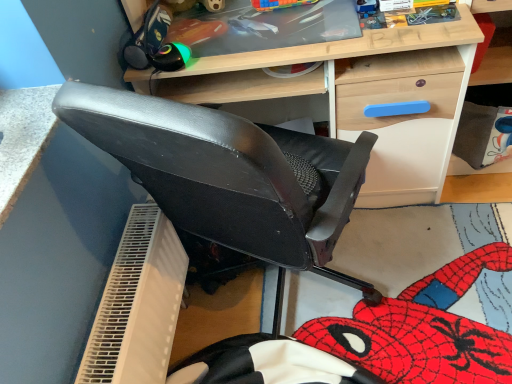
The image size is (512, 384). What are the coordinates of `white textured table at upper left` in the screenshot? It's located at (22, 138).

Image resolution: width=512 pixels, height=384 pixels. Describe the element at coordinates (22, 138) in the screenshot. I see `white textured table at upper left` at that location.

Describe the element at coordinates (362, 96) in the screenshot. I see `light wood desk at center` at that location.

What is the approximate width of light wood desk at center?

22.04 inches.

In order to face light wood desk at center, should I rotate leftwards or rightwards?

Turn right by 5.870 degrees to look at light wood desk at center.

Identify the location of light wood desk at center. This screenshot has width=512, height=384. coord(362,96).

I want to click on white textured table at upper left, so click(22, 138).

Considering the relative positions of white textured table at upper left and light wood desk at center in the image provided, is white textured table at upper left to the left of light wood desk at center from the viewer's perspective?

Correct, you'll find white textured table at upper left to the left of light wood desk at center.

Does white textured table at upper left lie in front of light wood desk at center?

Yes, white textured table at upper left is closer to the viewer.

Is point (24, 130) positioned in front of point (345, 133)?

Yes, it is in front of point (345, 133).

From the image's perspective, which is above, white textured table at upper left or light wood desk at center?

light wood desk at center appears higher in the image.

From a real-world perspective, is white textured table at upper left on light wood desk at center?

Indeed, from a real-world perspective, white textured table at upper left stands above light wood desk at center.

Considering the relative sizes of white textured table at upper left and light wood desk at center in the image provided, is white textured table at upper left wider than light wood desk at center?

No, white textured table at upper left is not wider than light wood desk at center.

Considering the sizes of objects white textured table at upper left and light wood desk at center in the image provided, who is shorter, white textured table at upper left or light wood desk at center?

Standing shorter between the two is white textured table at upper left.

Considering the sizes of objects white textured table at upper left and light wood desk at center in the image provided, who is smaller, white textured table at upper left or light wood desk at center?

white textured table at upper left.

Is light wood desk at center a part of white textured table at upper left?

Definitely not — light wood desk at center is not inside white textured table at upper left.

Is white textured table at upper left far from light wood desk at center?

Actually, white textured table at upper left and light wood desk at center are a little close together.

Is white textured table at upper left oriented away from light wood desk at center?

No, white textured table at upper left's orientation is not away from light wood desk at center.

How different are the orientations of white textured table at upper left and light wood desk at center in degrees?

88.8 degrees.

Identify the location of desk that appears below the white textured table at upper left (from a real-world perspective). (362, 96).

Considering the relative positions of light wood desk at center and white textured table at upper left in the image provided, is light wood desk at center to the left or to the right of white textured table at upper left?

From the image, it's evident that light wood desk at center is to the right of white textured table at upper left.

Which object is further away from the camera taking this photo, light wood desk at center or white textured table at upper left?

light wood desk at center is further away from the camera.

Is point (399, 85) more distant than point (2, 131)?

That is True.

From the image's perspective, which one is positioned lower, light wood desk at center or white textured table at upper left?

white textured table at upper left, from the image's perspective.

From a real-world perspective, is light wood desk at center under white textured table at upper left?

Indeed, from a real-world perspective, light wood desk at center is positioned beneath white textured table at upper left.

Considering the sizes of objects light wood desk at center and white textured table at upper left in the image provided, who is wider, light wood desk at center or white textured table at upper left?

Wider between the two is light wood desk at center.

Can you confirm if light wood desk at center is shorter than white textured table at upper left?

Incorrect, the height of light wood desk at center does not fall short of that of white textured table at upper left.

Considering the sizes of light wood desk at center and white textured table at upper left in the image, is light wood desk at center bigger or smaller than white textured table at upper left?

Considering their sizes, light wood desk at center takes up more space than white textured table at upper left.

Which is correct: light wood desk at center is inside white textured table at upper left, or outside of it?

light wood desk at center is not inside white textured table at upper left, it's outside.

Is light wood desk at center with white textured table at upper left?

They are not placed beside each other.

Is light wood desk at center oriented away from white textured table at upper left?

No, white textured table at upper left is not at the back of light wood desk at center.

Looking at this image, how many degrees apart are the facing directions of light wood desk at center and white textured table at upper left?

The angle between the facing direction of light wood desk at center and the facing direction of white textured table at upper left is 88.8 degrees.

Locate an element on the screen. table located in front of the light wood desk at center is located at coordinates (22, 138).

The image size is (512, 384). What are the coordinates of `desk below the white textured table at upper left (from a real-world perspective)` in the screenshot? It's located at (362, 96).

You are a GUI agent. You are given a task and a screenshot of the screen. Output one action in this format:
    pyautogui.click(x=<x>, y=<y>)
    Task: Click on the desk on the right of white textured table at upper left
    Image resolution: width=512 pixels, height=384 pixels.
    Given the screenshot: What is the action you would take?
    (362, 96)